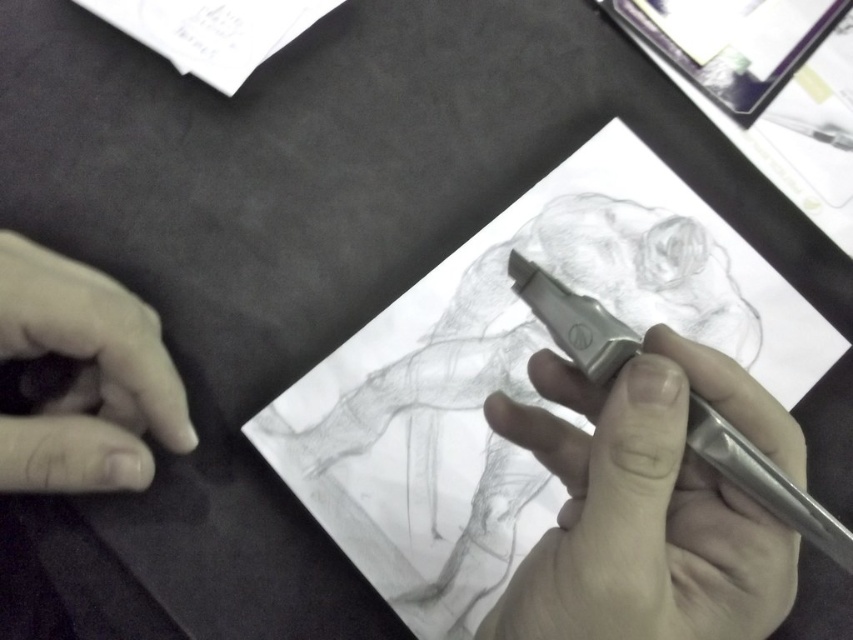
You are an art student trying to transfer a sketch onto another surface. You have the graphite paper at center and the smooth skin at lower left in your view. Which object should you use to ensure the sketch transfers accurately?

The graphite paper at center should be used to transfer the sketch accurately because it is positioned under the smooth skin at lower left, allowing the design to be transferred through pressure.

The image shows a person drawing a human figure on a white paper using a mechanical pencil. There is also a point labeled at coordinates [514,376]. Where exactly is this point located in relation to the graphite paper at center?

The point labeled at coordinates [514,376] is located on the graphite paper at center.